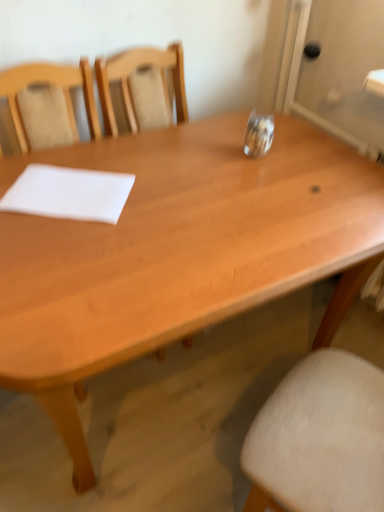
Image resolution: width=384 pixels, height=512 pixels. In order to click on free space above white paper at left (from a real-world perspective) in this screenshot , I will do `click(62, 183)`.